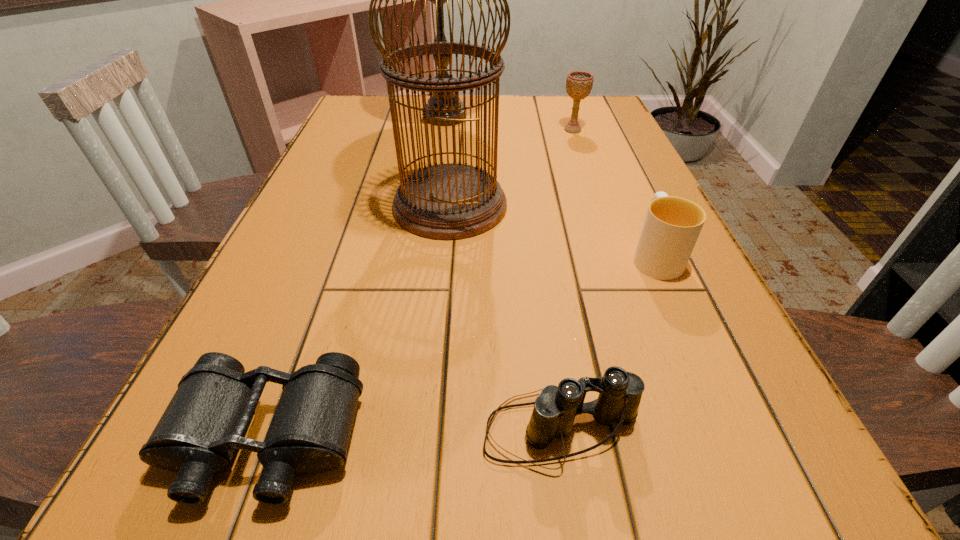
I want to click on chalice present at the right edge, so click(578, 83).

Where is `cup positioned at the right edge`? The image size is (960, 540). cup positioned at the right edge is located at coordinates (672, 225).

What are the coordinates of `object that is at the far left corner` in the screenshot? It's located at (440, 26).

Find the location of `object that is positioned at the near left corner`. object that is positioned at the near left corner is located at coordinates pos(206,420).

The image size is (960, 540). Identify the location of object present at the far right corner. (578, 83).

This screenshot has width=960, height=540. In the image, there is a desktop. Identify the location of vacant region at the left edge. (341, 222).

The width and height of the screenshot is (960, 540). In the image, there is a desktop. Find the location of `blank space at the right edge`. blank space at the right edge is located at coordinates (775, 451).

The width and height of the screenshot is (960, 540). Find the location of `vacant space at the far right corner of the desktop`. vacant space at the far right corner of the desktop is located at coordinates (605, 106).

Identify the location of unoccupied area between the shortest object and the birdcage. (358, 322).

At what (x,y) coordinates should I click in order to perform the action: click on blank region between the shortest object and the birdcage. Please return your answer as a coordinate pair (x, y). The height and width of the screenshot is (540, 960). Looking at the image, I should click on (358, 322).